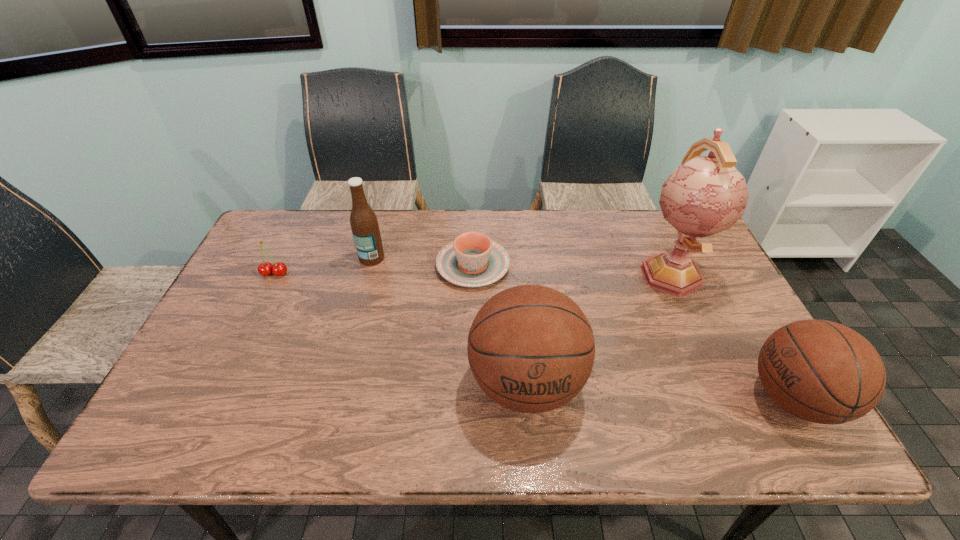
Find the location of a particular element. vacant area that lies between the taller basketball and the beer bottle is located at coordinates (449, 320).

Locate an element on the screen. free area in between the taller basketball and the fifth tallest object is located at coordinates (400, 328).

Where is `free area in between the taller basketball and the globe`? free area in between the taller basketball and the globe is located at coordinates (598, 328).

Find the location of a particular element. free spot between the right basketball and the tallest object is located at coordinates (732, 335).

You are a GUI agent. You are given a task and a screenshot of the screen. Output one action in this format:
    pyautogui.click(x=<x>, y=<y>)
    Task: Click on the free space between the globe and the shorter basketball
    This screenshot has width=960, height=540.
    Given the screenshot: What is the action you would take?
    pyautogui.click(x=732, y=335)

Where is `free space between the chinaware and the cherry`? This screenshot has width=960, height=540. free space between the chinaware and the cherry is located at coordinates 373,269.

Image resolution: width=960 pixels, height=540 pixels. In order to click on vacant area that lies between the taller basketball and the second object from left to right in this screenshot , I will do `click(449, 320)`.

At what (x,y) coordinates should I click in order to perform the action: click on vacant area between the left basketball and the beer bottle. Please return your answer as a coordinate pair (x, y). The height and width of the screenshot is (540, 960). Looking at the image, I should click on (449, 320).

Select which object is the third closest to the tallest object. Please provide its 2D coordinates. Your answer should be formatted as a tuple, i.e. [(x, y)], where the tuple contains the x and y coordinates of a point satisfying the conditions above.

[(472, 260)]

Select which object is the third closest to the right basketball. Please provide its 2D coordinates. Your answer should be formatted as a tuple, i.e. [(x, y)], where the tuple contains the x and y coordinates of a point satisfying the conditions above.

[(472, 260)]